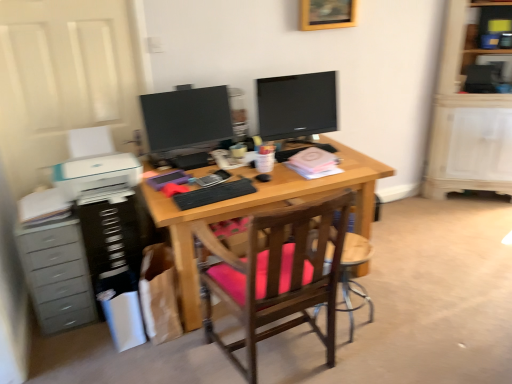
Question: Can we say wooden chair at center lies outside matte black monitor at center, which ranks as the 2th television in right-to-left order?

Choices:
 (A) no
 (B) yes

Answer: (B)

Question: Does wooden chair at center appear on the left side of matte black monitor at center, which ranks as the 2th television in right-to-left order?

Choices:
 (A) no
 (B) yes

Answer: (A)

Question: Is wooden chair at center behind matte black monitor at center, arranged as the 1th television when viewed from the left?

Choices:
 (A) no
 (B) yes

Answer: (A)

Question: Does wooden chair at center have a smaller size compared to matte black monitor at center, arranged as the 1th television when viewed from the left?

Choices:
 (A) yes
 (B) no

Answer: (B)

Question: Is wooden chair at center bigger than matte black monitor at center, which ranks as the 2th television in right-to-left order?

Choices:
 (A) no
 (B) yes

Answer: (B)

Question: From the image's perspective, is wooden picture frame at upper center above or below black matte keyboard at center?

Choices:
 (A) below
 (B) above

Answer: (B)

Question: Is point (336, 23) closer or farther from the camera than point (215, 192)?

Choices:
 (A) farther
 (B) closer

Answer: (A)

Question: In terms of size, does wooden picture frame at upper center appear bigger or smaller than black matte keyboard at center?

Choices:
 (A) small
 (B) big

Answer: (B)

Question: Based on their positions, is wooden picture frame at upper center located to the left or right of black matte keyboard at center?

Choices:
 (A) left
 (B) right

Answer: (B)

Question: Choose the correct answer: Is black matte keyboard at center inside matte black monitor at center, the 2th television when ordered from left to right, or outside it?

Choices:
 (A) inside
 (B) outside

Answer: (B)

Question: From a real-world perspective, is black matte keyboard at center positioned above or below matte black monitor at center, the 2th television when ordered from left to right?

Choices:
 (A) above
 (B) below

Answer: (B)

Question: Visually, is black matte keyboard at center positioned to the left or to the right of matte black monitor at center, the 2th television when ordered from left to right?

Choices:
 (A) right
 (B) left

Answer: (B)

Question: Looking at their shapes, would you say black matte keyboard at center is wider or thinner than matte black monitor at center, marked as the 1th television in a right-to-left arrangement?

Choices:
 (A) wide
 (B) thin

Answer: (A)

Question: Is point (76, 235) closer or farther from the camera than point (76, 302)?

Choices:
 (A) farther
 (B) closer

Answer: (B)

Question: Which is correct: black plastic dresser at left is inside gray plastic chest of drawers at left, or outside of it?

Choices:
 (A) inside
 (B) outside

Answer: (B)